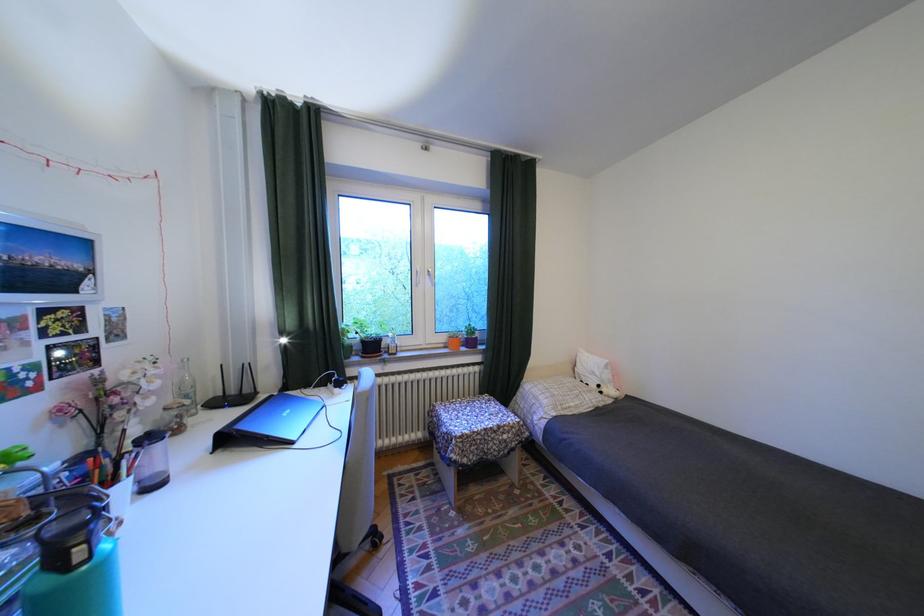
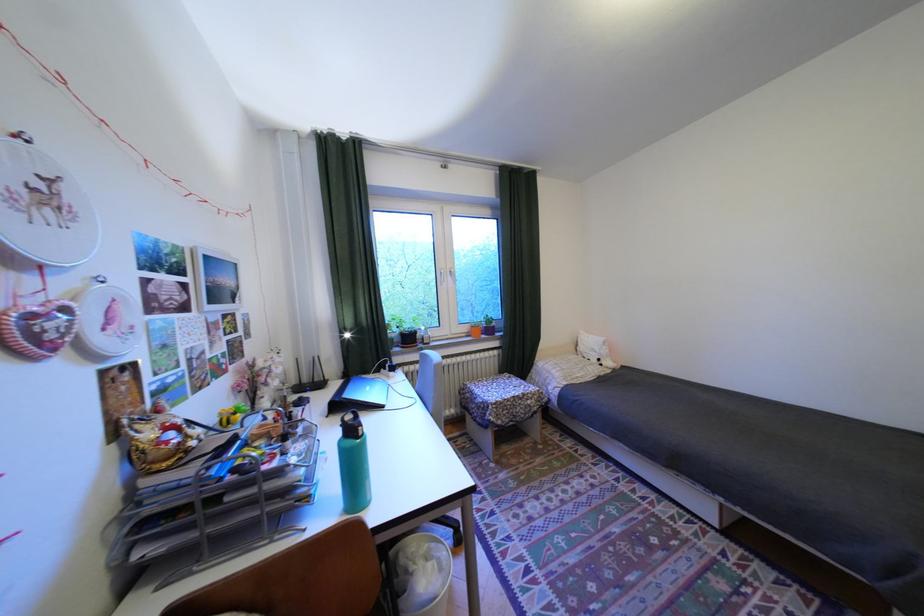
In the second image, find the point that corresponds to point 58,581 in the first image.

(361, 443)